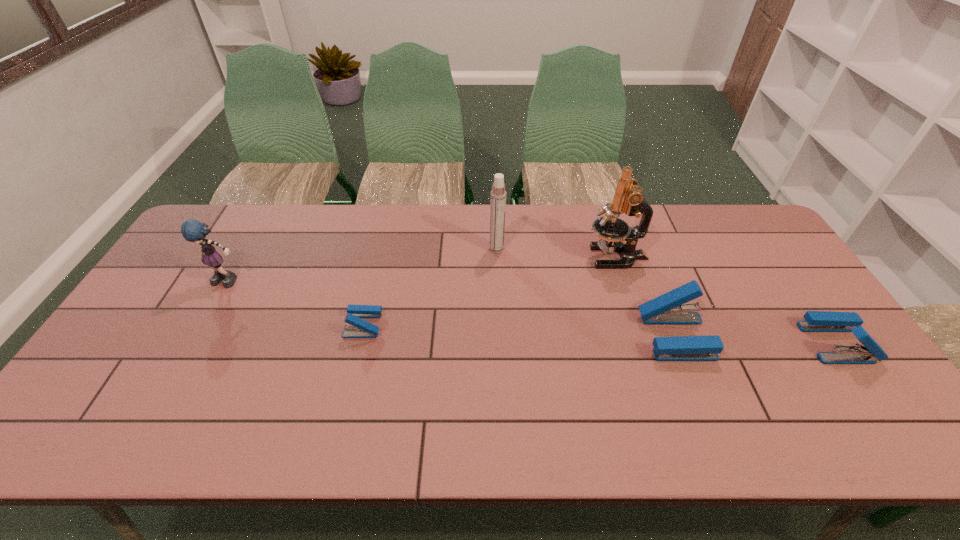
Locate an element on the screen. The height and width of the screenshot is (540, 960). empty space that is in between the shortest object and the rag doll is located at coordinates (297, 303).

What are the coordinates of `unoccupied area between the third tallest object and the shortest object` in the screenshot? It's located at (297, 303).

Find the location of a particular element. This screenshot has width=960, height=540. empty location between the second stapler from left to right and the second tallest object is located at coordinates (586, 293).

You are a GUI agent. You are given a task and a screenshot of the screen. Output one action in this format:
    pyautogui.click(x=<x>, y=<y>)
    Task: Click on the unoccupied position between the third farthest object and the second stapler from left to right
    The height and width of the screenshot is (540, 960).
    Given the screenshot: What is the action you would take?
    pyautogui.click(x=452, y=309)

The width and height of the screenshot is (960, 540). Identify the location of empty location between the second stapler from left to right and the third farthest object. (452, 309).

Image resolution: width=960 pixels, height=540 pixels. Identify the location of vacant area that lies between the leftmost object and the microscope. (422, 269).

This screenshot has height=540, width=960. Find the location of `the fifth closest object to the microscope`. the fifth closest object to the microscope is located at coordinates (192, 230).

Locate which object ranks second in proximity to the fourth shortest object. Please provide its 2D coordinates. Your answer should be formatted as a tuple, i.e. [(x, y)], where the tuple contains the x and y coordinates of a point satisfying the conditions above.

[(498, 194)]

Select which stapler appears as the closest to the second stapler from right to left. Please provide its 2D coordinates. Your answer should be formatted as a tuple, i.e. [(x, y)], where the tuple contains the x and y coordinates of a point satisfying the conditions above.

[(816, 321)]

Locate an element on the screen. This screenshot has width=960, height=540. stapler that stands as the closest to the microscope is located at coordinates (670, 308).